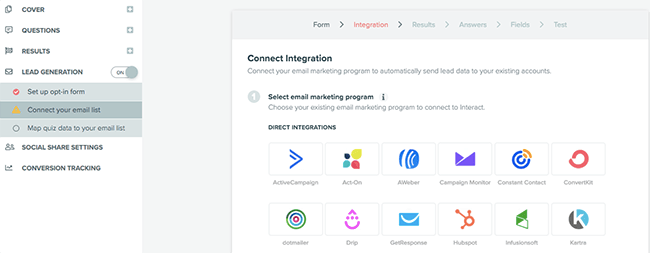
Image resolution: width=650 pixels, height=253 pixels. In order to click on on-off button in this screenshot , I will do `click(122, 70)`.